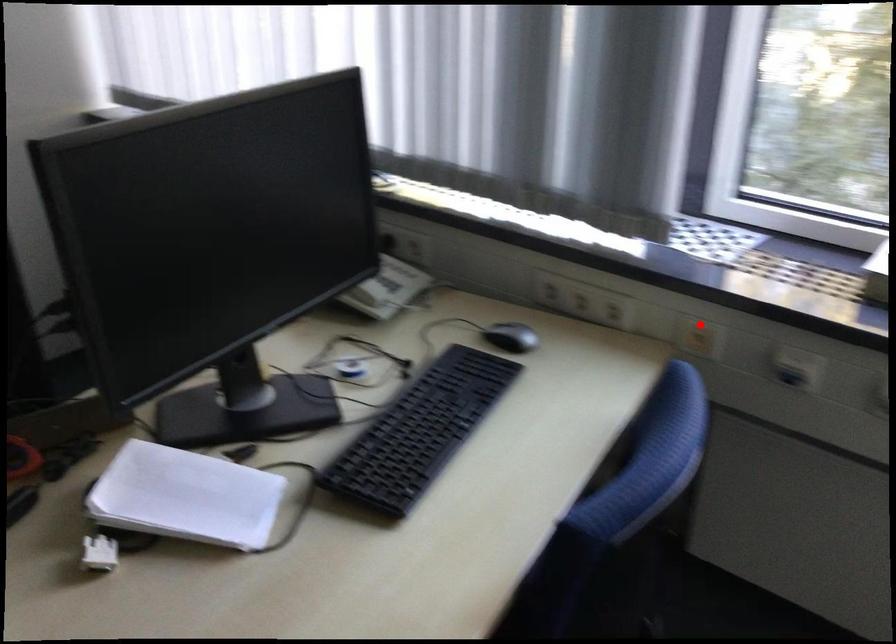
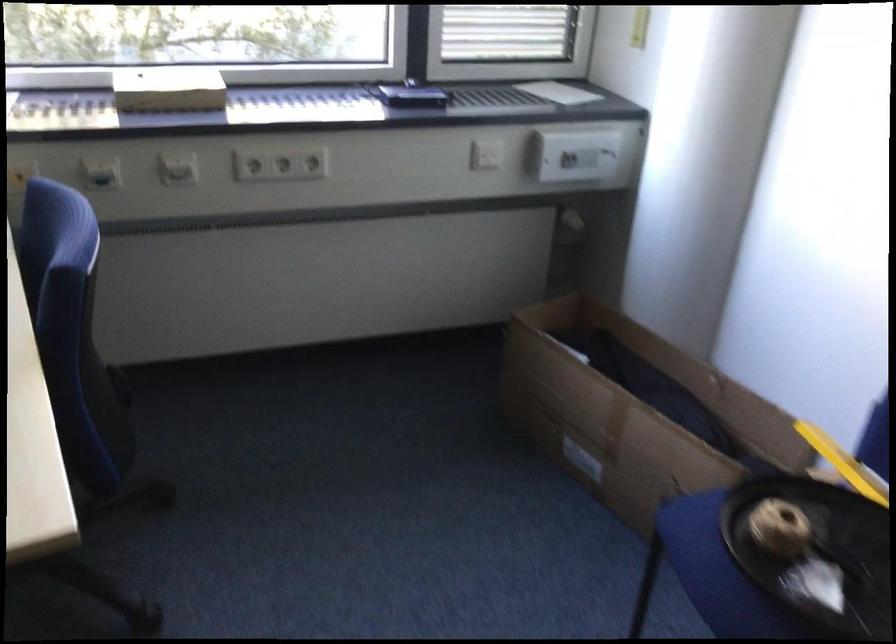
Question: A red point is marked in image1. In image2, is the corresponding 3D point closer to the camera or farther? Reply with the corresponding letter.

Choices:
 (A) The corresponding 3D point is closer.
 (B) The corresponding 3D point is farther.

Answer: (B)